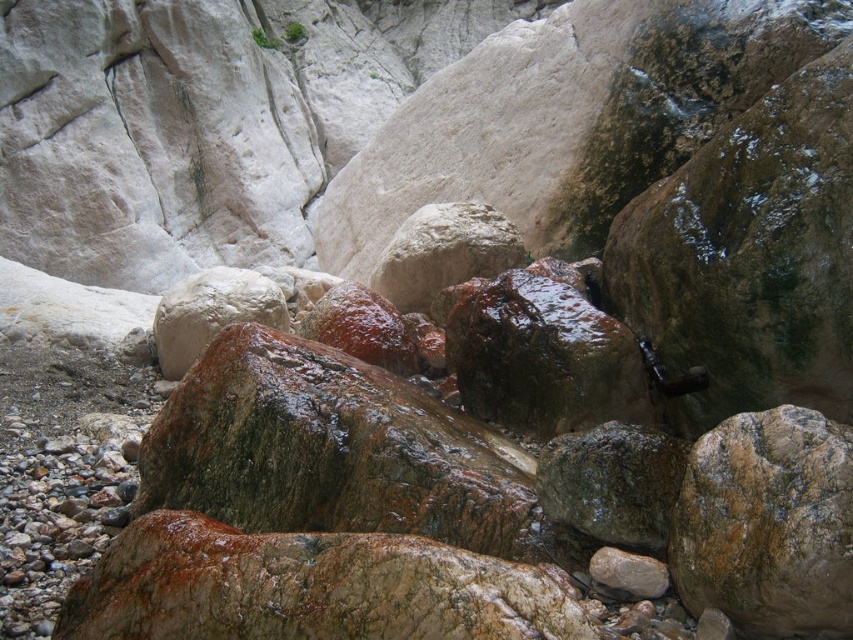
Between brown rough rock at center and rusty metallic rock at center, which one is positioned higher?

rusty metallic rock at center

From the picture: Is brown rough rock at center bigger than rusty metallic rock at center?

Actually, brown rough rock at center might be smaller than rusty metallic rock at center.

The width and height of the screenshot is (853, 640). Find the location of `brown rough rock at center`. brown rough rock at center is located at coordinates (767, 524).